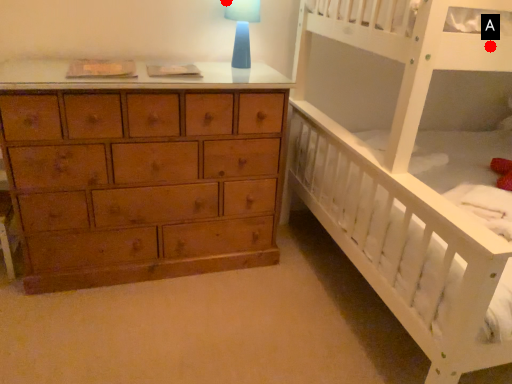
Question: Two points are circled on the image, labeled by A and B beside each circle. Which point is closer to the camera taking this photo?

Choices:
 (A) A is closer
 (B) B is closer

Answer: (A)